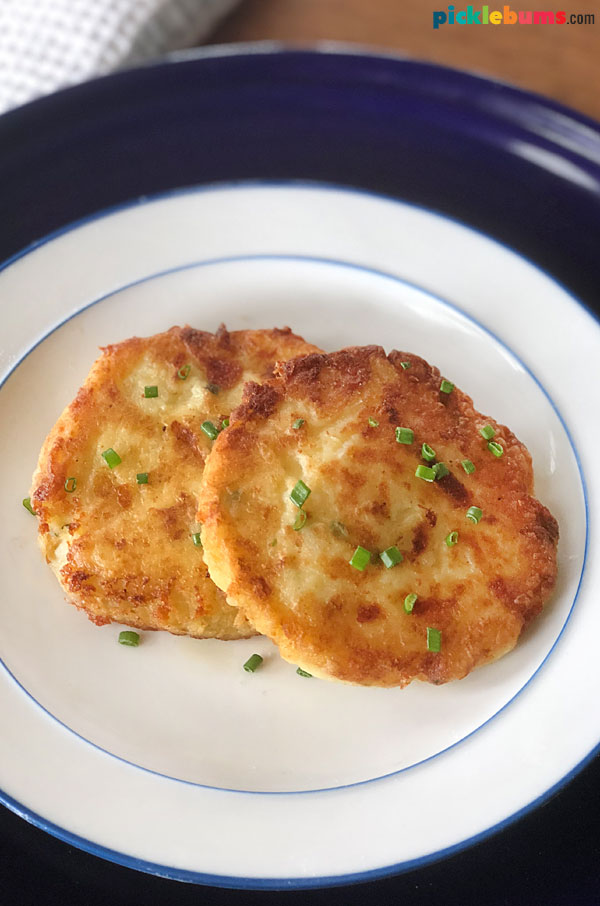
At what (x,y) coordinates should I click in order to perform the action: click on plate. Please return your answer as a coordinate pair (x, y). This screenshot has width=600, height=906. Looking at the image, I should click on (288, 720).